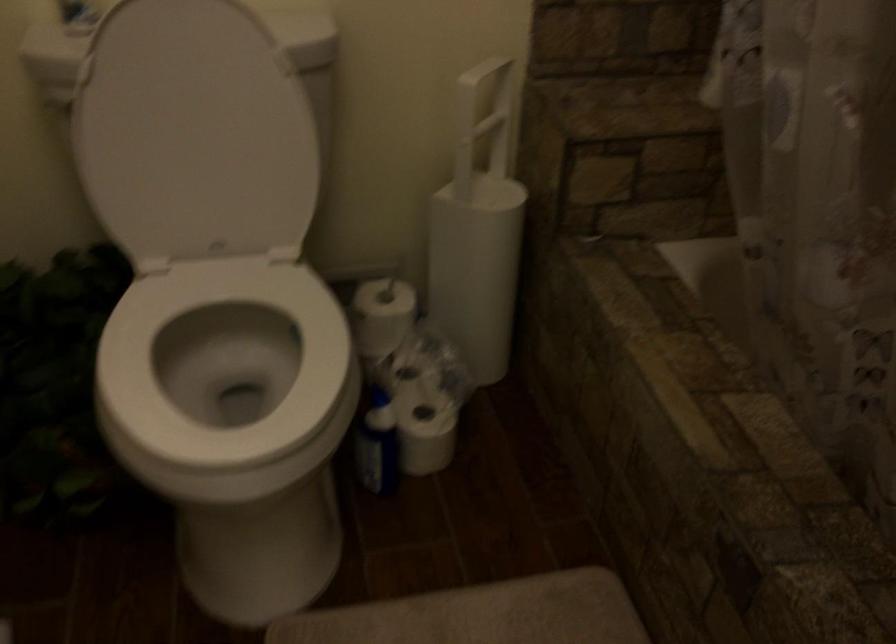
Where is `white toilet seat`? This screenshot has height=644, width=896. white toilet seat is located at coordinates (224, 365).